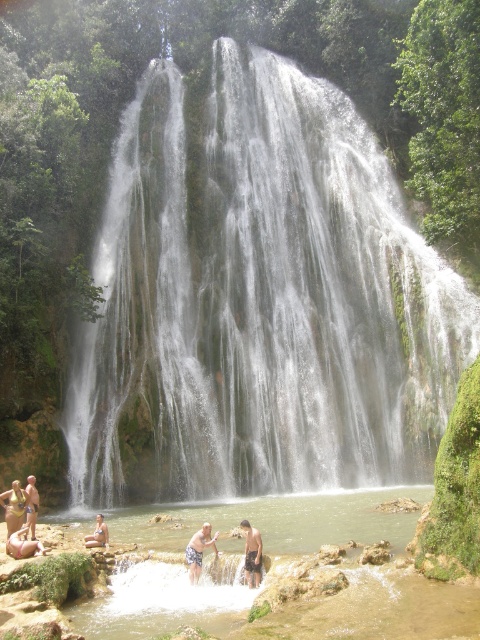
Is matte yellow bikini at lower left positioned behind tan skin human at lower left?

No, matte yellow bikini at lower left is in front of tan skin human at lower left.

How much distance is there between matte yellow bikini at lower left and tan skin human at lower left?

matte yellow bikini at lower left is 4.50 meters away from tan skin human at lower left.

Is point (12, 499) closer to viewer compared to point (101, 529)?

No, (12, 499) is further to viewer.

The width and height of the screenshot is (480, 640). I want to click on matte yellow bikini at lower left, so click(x=13, y=506).

Does tan skin person at lower center have a smaller size compared to beige sand person at lower left?

No, tan skin person at lower center is not smaller than beige sand person at lower left.

Measure the distance between point (193,560) and camera.

93.18 feet

Image resolution: width=480 pixels, height=640 pixels. What are the coordinates of `tan skin person at lower center` in the screenshot? It's located at (199, 550).

Is tan skin human at lower center wider than tan skin person at lower left?

Incorrect, tan skin human at lower center's width does not surpass tan skin person at lower left's.

The height and width of the screenshot is (640, 480). Describe the element at coordinates (252, 554) in the screenshot. I see `tan skin human at lower center` at that location.

Identify the location of tan skin human at lower center. Image resolution: width=480 pixels, height=640 pixels. [252, 554].